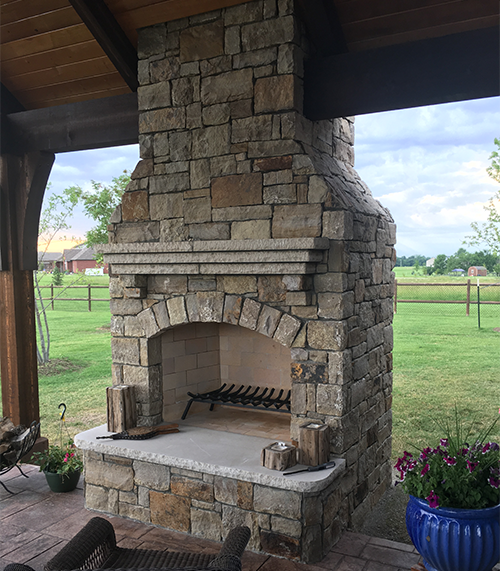
I want to click on black wicker chair, so click(x=127, y=561).